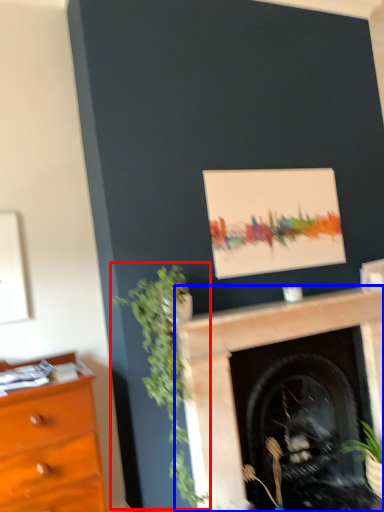
Question: Which object appears closest to the camera in this image, plant (highlighted by a red box) or fireplace (highlighted by a blue box)?

Choices:
 (A) plant
 (B) fireplace

Answer: (A)